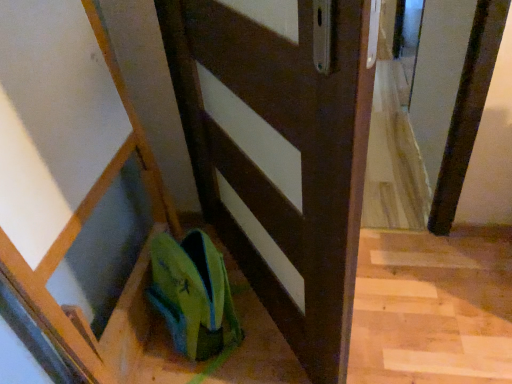
This screenshot has height=384, width=512. In order to click on unoccupied region to the right of green fabric shoe at lower center in this screenshot , I will do `click(258, 334)`.